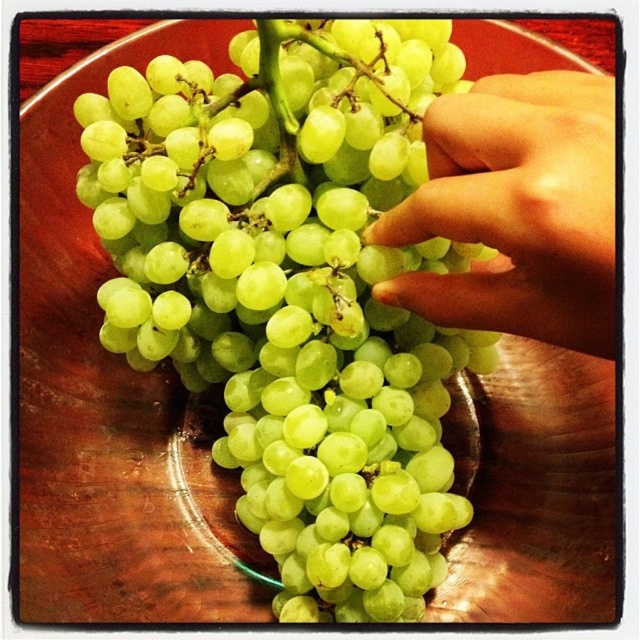
You are a chef preparing a fruit platter and need to place the green matte grapes at center and the smooth skin hand at upper right on the table. Based on their positions in the image, which object is closer to the edge of the table?

The smooth skin hand at upper right is closer to the edge of the table because it is positioned above the green matte grapes at center, which is located further inward.

You are taking a photo of the grapes and need to focus on the closest point to the camera between the two points marked as point (173, 77) and point (476, 236). Which point should you choose?

Point (173, 77) is further to the camera than point (476, 236), so you should focus on point (173, 77) as it is closer to the camera.